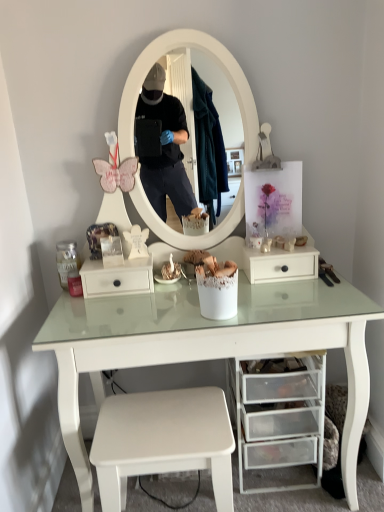
Question: Is white matte drawer at center, which appears as the second drawer when ordered from the bottom, surrounded by white matte stool at lower center?

Choices:
 (A) no
 (B) yes

Answer: (A)

Question: Is white matte stool at lower center to the left of white matte drawer at center, the 2th drawer from the right, from the viewer's perspective?

Choices:
 (A) no
 (B) yes

Answer: (A)

Question: From the image's perspective, is white matte stool at lower center above white matte drawer at center, the 2th drawer from the right?

Choices:
 (A) yes
 (B) no

Answer: (B)

Question: From a real-world perspective, is white matte stool at lower center on white matte drawer at center, which is counted as the first drawer, starting from the left?

Choices:
 (A) no
 (B) yes

Answer: (A)

Question: From the image's perspective, does white matte stool at lower center appear lower than white matte drawer at center, which appears as the second drawer when ordered from the bottom?

Choices:
 (A) no
 (B) yes

Answer: (B)

Question: Relative to transparent plastic drawers at lower center, the second drawer viewed from the top, is white matte drawer at center, acting as the first drawer starting from the top, in front or behind?

Choices:
 (A) behind
 (B) front

Answer: (A)

Question: Considering the positions of point (145, 280) and point (271, 404), is point (145, 280) closer or farther from the camera than point (271, 404)?

Choices:
 (A) closer
 (B) farther

Answer: (B)

Question: From the image's perspective, is white matte drawer at center, which appears as the second drawer when ordered from the bottom, located above or below transparent plastic drawers at lower center, the 1th drawer from the right?

Choices:
 (A) below
 (B) above

Answer: (B)

Question: From a real-world perspective, is white matte drawer at center, acting as the first drawer starting from the top, above or below transparent plastic drawers at lower center, which ranks as the 1th drawer in bottom-to-top order?

Choices:
 (A) above
 (B) below

Answer: (A)

Question: From the image's perspective, is white matte stool at lower center positioned above or below white matte drawer at center, the 2th drawer from the right?

Choices:
 (A) above
 (B) below

Answer: (B)

Question: Would you say white matte stool at lower center is inside or outside white matte drawer at center, which appears as the second drawer when ordered from the bottom?

Choices:
 (A) inside
 (B) outside

Answer: (B)

Question: Is point (200, 417) positioned closer to the camera than point (122, 266)?

Choices:
 (A) farther
 (B) closer

Answer: (B)

Question: Is white matte stool at lower center wider or thinner than white matte drawer at center, the 2th drawer from the right?

Choices:
 (A) wide
 (B) thin

Answer: (A)

Question: Looking at their shapes, would you say transparent plastic drawers at lower center, which is the second drawer from left to right, is wider or thinner than white matte stool at lower center?

Choices:
 (A) thin
 (B) wide

Answer: (B)

Question: Would you say transparent plastic drawers at lower center, the 1th drawer from the right, is inside or outside white matte stool at lower center?

Choices:
 (A) outside
 (B) inside

Answer: (A)